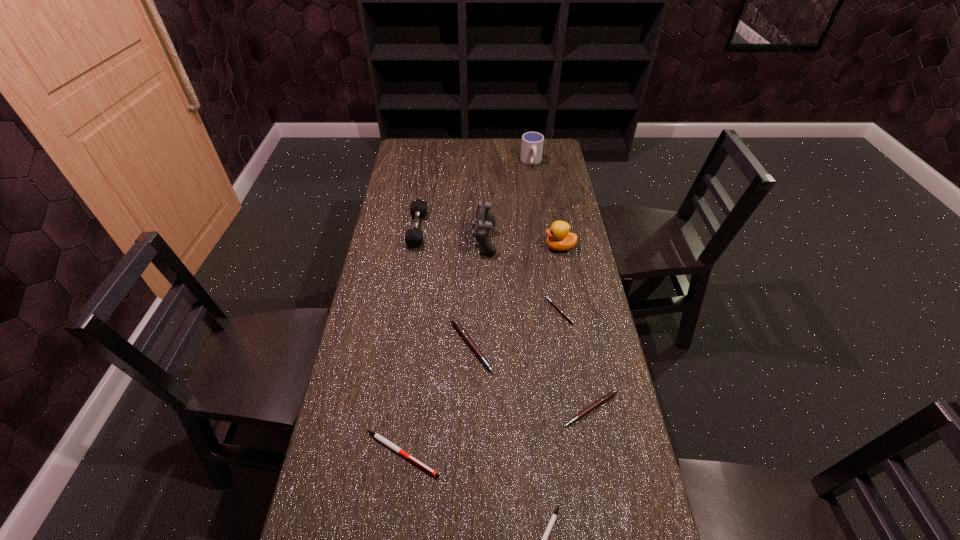
Where is `vacant space situated 0.120m at the nib of the third nearest object`? The height and width of the screenshot is (540, 960). vacant space situated 0.120m at the nib of the third nearest object is located at coordinates (603, 476).

At what (x,y) coordinates should I click in order to perform the action: click on vacant region located 0.170m on the clicker of the second nearest object. Please return your answer as a coordinate pair (x, y). Looking at the image, I should click on (511, 454).

Locate an element on the screen. Image resolution: width=960 pixels, height=540 pixels. vacant space located at the nib of the smallest pink pen is located at coordinates (445, 310).

The image size is (960, 540). Find the location of `free spot located at the nib of the smallest pink pen`. free spot located at the nib of the smallest pink pen is located at coordinates (426, 310).

I want to click on vacant space located 0.230m at the nib of the smallest pink pen, so click(x=474, y=310).

What are the coordinates of `object that is at the far edge` in the screenshot? It's located at (532, 142).

The height and width of the screenshot is (540, 960). What are the coordinates of `dumbbell present at the left edge` in the screenshot? It's located at (414, 237).

This screenshot has height=540, width=960. I want to click on pen that is at the left edge, so click(x=383, y=440).

Locate an element on the screen. cup positioned at the right edge is located at coordinates (532, 142).

You are a GUI agent. You are given a task and a screenshot of the screen. Output one action in this format:
    pyautogui.click(x=<x>, y=<y>)
    Task: Click on the duckling present at the right edge
    This screenshot has height=540, width=960.
    Given the screenshot: What is the action you would take?
    pyautogui.click(x=559, y=238)